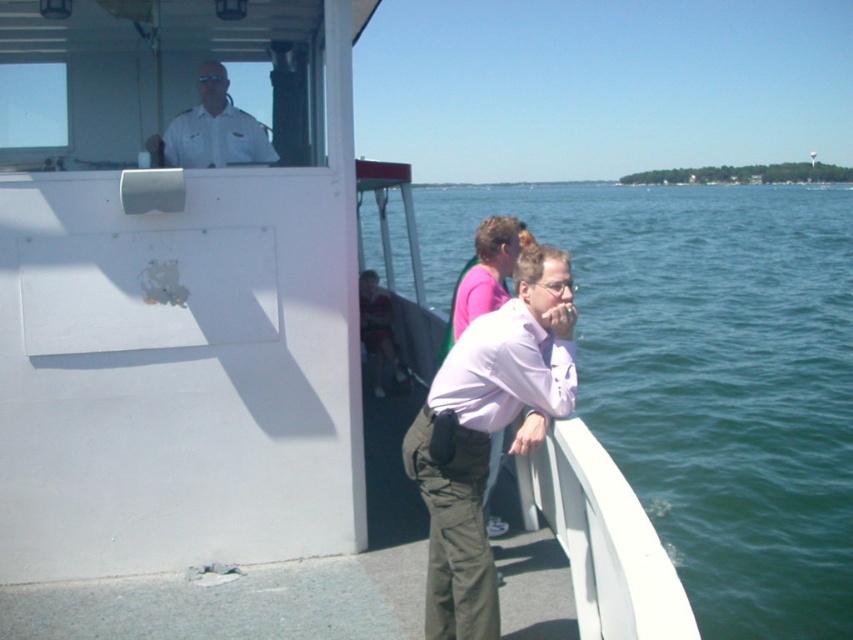
Question: Does white uniform at upper center appear on the left side of matte black shirt at center?

Choices:
 (A) no
 (B) yes

Answer: (B)

Question: Does green water at right appear over matte black shirt at center?

Choices:
 (A) yes
 (B) no

Answer: (A)

Question: Which is farther from the light purple shirt at center?

Choices:
 (A) matte black shirt at center
 (B) white uniform at upper center

Answer: (A)

Question: Can you confirm if white uniform at upper center is wider than pink fabric shirt at center?

Choices:
 (A) yes
 (B) no

Answer: (A)

Question: Which of the following is the farthest from the observer?

Choices:
 (A) (186, 113)
 (B) (550, 397)

Answer: (A)

Question: Estimate the real-world distances between objects in this image. Which object is farther from the light purple shirt at center?

Choices:
 (A) green water at right
 (B) pink fabric shirt at center

Answer: (A)